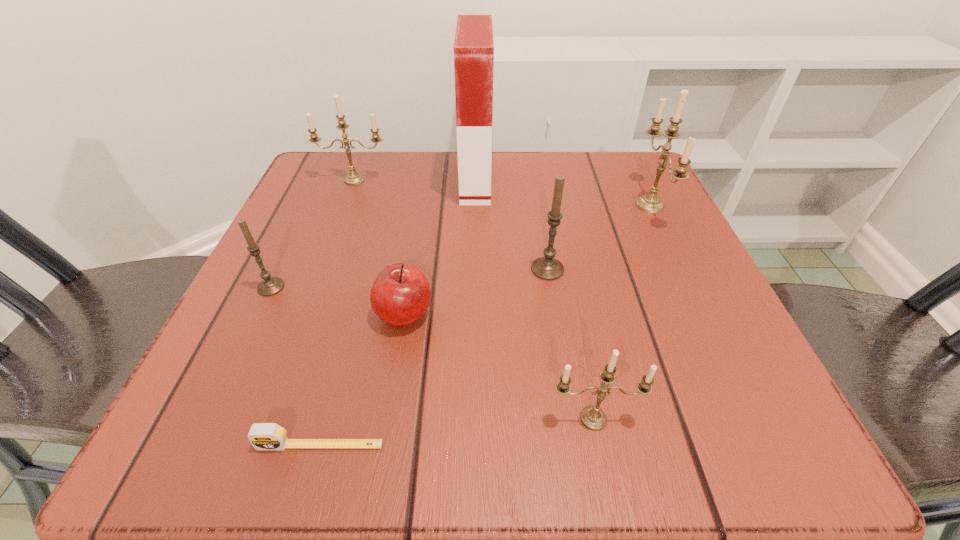
Where is `metallic candle that is the third closest to the apple`? The image size is (960, 540). metallic candle that is the third closest to the apple is located at coordinates (651, 203).

At what (x,y) coordinates should I click in order to perform the action: click on vacant space that satisfies the following two spatial constraints: 1. on the back side of the smallest metallic candle; 2. on the left side of the tallest candle. Please return your answer as a coordinate pair (x, y). This screenshot has height=540, width=960. Looking at the image, I should click on (551, 205).